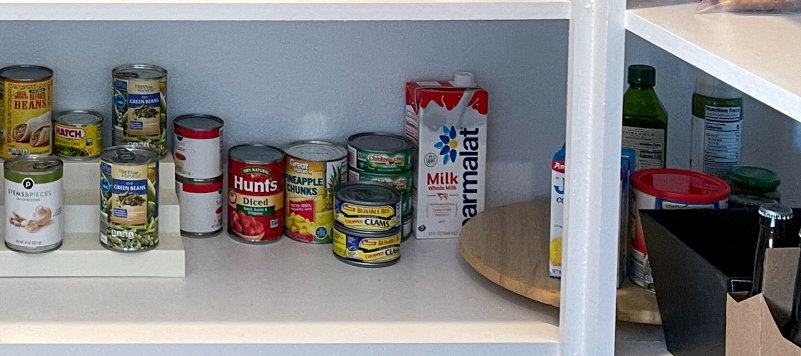
Locate an element on the screen. The width and height of the screenshot is (801, 356). pantry shelves is located at coordinates (689, 58), (256, 316).